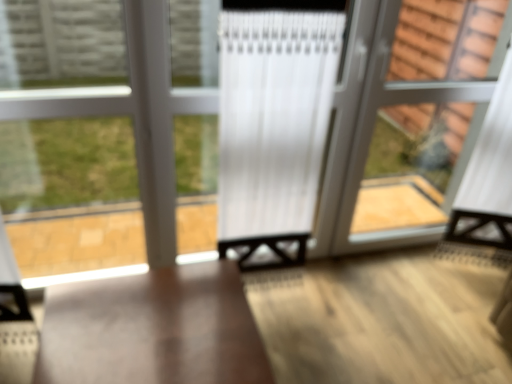
Question: Is matte wood table at center thinner than clear glass bay window at left?

Choices:
 (A) no
 (B) yes

Answer: (A)

Question: Is matte wood table at center wider than clear glass bay window at left?

Choices:
 (A) yes
 (B) no

Answer: (A)

Question: Is matte wood table at center not near clear glass bay window at left?

Choices:
 (A) no
 (B) yes

Answer: (A)

Question: Is matte wood table at center to the right of clear glass bay window at left from the viewer's perspective?

Choices:
 (A) no
 (B) yes

Answer: (B)

Question: Does matte wood table at center come in front of clear glass bay window at left?

Choices:
 (A) no
 (B) yes

Answer: (B)

Question: Relative to clear glass screen door at right, is clear glass bay window at left in front or behind?

Choices:
 (A) behind
 (B) front

Answer: (B)

Question: Considering the positions of clear glass bay window at left and clear glass screen door at right in the image, is clear glass bay window at left wider or thinner than clear glass screen door at right?

Choices:
 (A) thin
 (B) wide

Answer: (A)

Question: Is point (196, 165) closer or farther from the camera than point (386, 130)?

Choices:
 (A) farther
 (B) closer

Answer: (B)

Question: Looking at the image, does clear glass bay window at left seem bigger or smaller compared to clear glass screen door at right?

Choices:
 (A) small
 (B) big

Answer: (A)

Question: Is clear glass screen door at right inside or outside of clear glass bay window at left?

Choices:
 (A) outside
 (B) inside

Answer: (A)

Question: Considering the positions of point (422, 241) and point (195, 165), is point (422, 241) closer or farther from the camera than point (195, 165)?

Choices:
 (A) farther
 (B) closer

Answer: (A)

Question: From the image's perspective, is clear glass screen door at right located above or below clear glass bay window at left?

Choices:
 (A) above
 (B) below

Answer: (A)

Question: In terms of width, does clear glass screen door at right look wider or thinner when compared to clear glass bay window at left?

Choices:
 (A) thin
 (B) wide

Answer: (B)

Question: Is clear glass bay window at left inside or outside of matte wood table at center?

Choices:
 (A) inside
 (B) outside

Answer: (B)

Question: Looking at their shapes, would you say clear glass bay window at left is wider or thinner than matte wood table at center?

Choices:
 (A) thin
 (B) wide

Answer: (A)